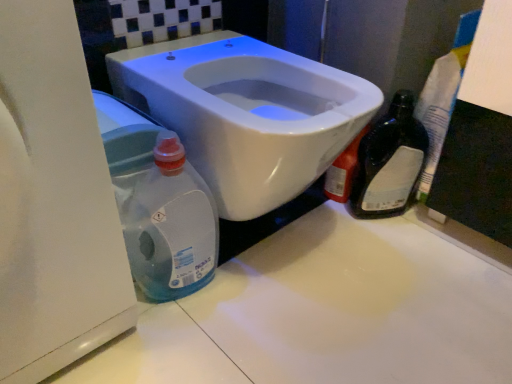
Image resolution: width=512 pixels, height=384 pixels. In order to click on empty space that is in between translucent plastic bottle at lower left and black glass bottle at right in this screenshot , I will do `click(295, 243)`.